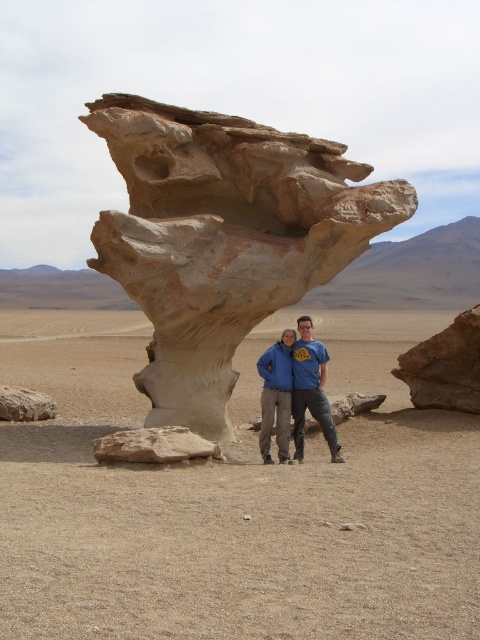
You are a photographer planning to take a wide shot of the white sandstone rock formation at center and the smooth beige rock at lower left. If your camera can capture a maximum distance of 20 meters between the two objects in the frame, will you be able to include both in a single shot?

The white sandstone rock formation at center is 23.10 meters away from the smooth beige rock at lower left. Since the camera can only capture up to 20 meters between objects, you cannot include both in a single shot.

You are a photographer trying to capture the entire white sandstone rock formation at center and the blue fleece jacket at center in one frame. Based on their sizes, which object will require you to step back further to include both in the shot?

The white sandstone rock formation at center is wider than the blue fleece jacket at center, so you will need to step back further to include both in the shot.

In the scene shown: You are planning to take a photo of the white sandstone rock formation at center and the smooth beige rock at lower left. Which rock should you focus on first if you want to capture the tallest object in the scene?

The white sandstone rock formation at center is taller than the smooth beige rock at lower left, so you should focus on the white sandstone rock formation at center first to capture the tallest object in the scene.